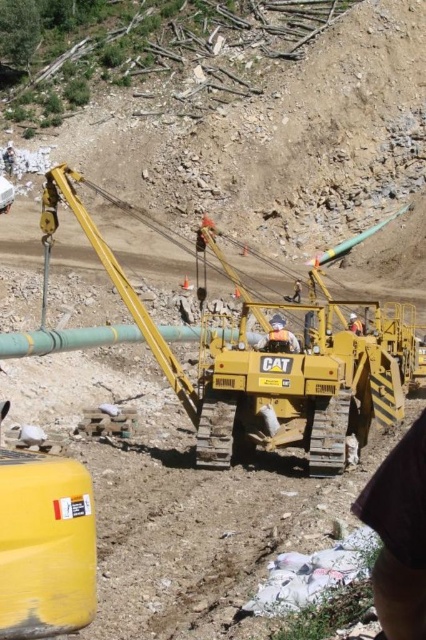
You are a construction supervisor who needs to ensure safety compliance. The green matte pipe at center and the white fabric construction worker at center are in the same area. According to safety protocols, which object should be moved first to ensure proper clearance for the crane operation?

The white fabric construction worker at center should be moved first because the green matte pipe at center is larger and likely part of the crane operation, so moving the worker ensures safety and avoids obstructing the pipe during lifting.

You are a construction supervisor observing the scene. There is a green matte pipe at center and a white fabric construction worker at center. Which object is closer to you?

The green matte pipe at center is closer to you since it is in front of the white fabric construction worker at center.

You are a construction worker on the site and need to place a safety net below the white fabric construction worker at center to catch any falling debris. Where should you position the safety net in relation to the green matte pipe at center?

The green matte pipe at center is located below the white fabric construction worker at center, so you should position the safety net below the white fabric construction worker at center, which is above the green matte pipe at center.